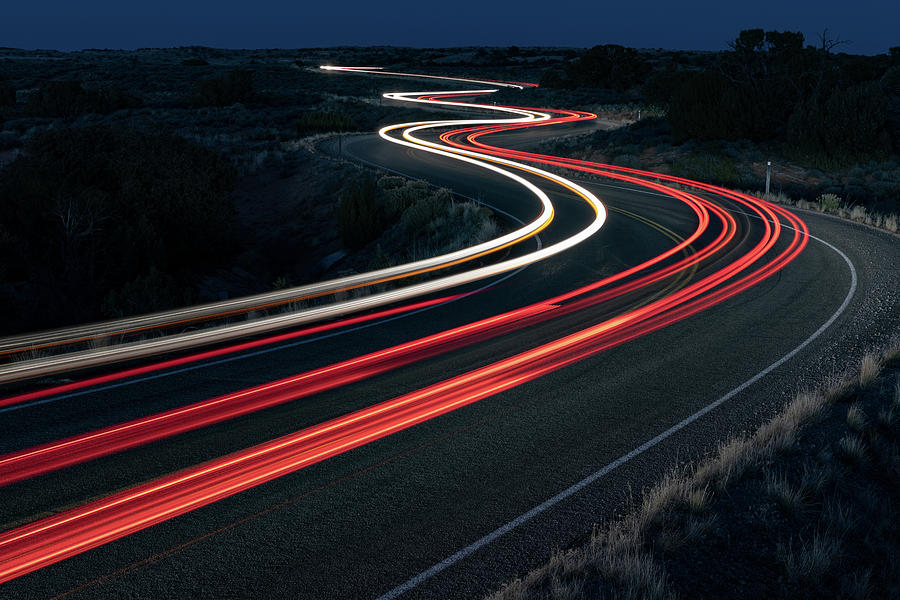
At what (x,y) coordinates should I click in order to perform the action: click on corner. Please return your answer as a coordinate pair (x, y). This screenshot has height=600, width=900. Looking at the image, I should click on (880, 583), (9, 586), (15, 15), (889, 10).